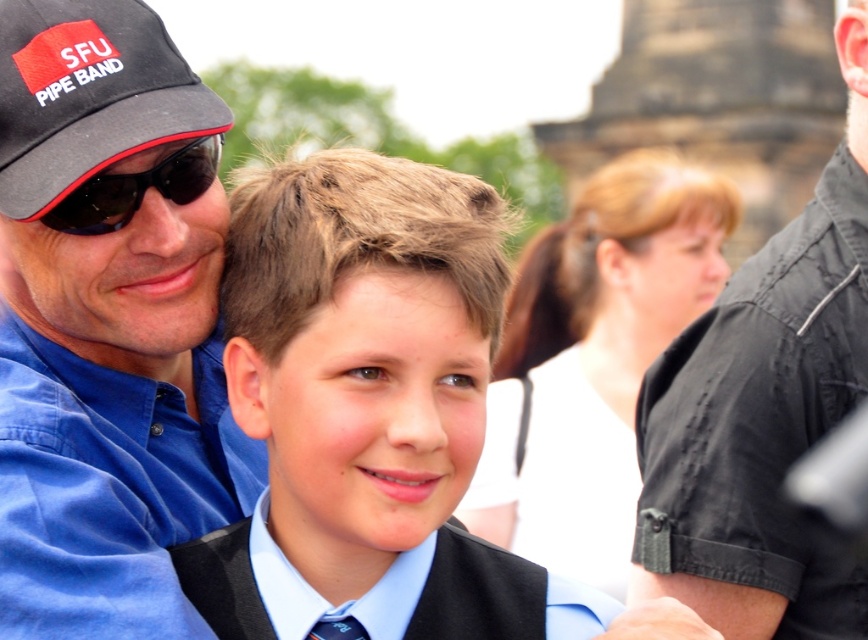
Is black fabric baseball cap at upper left positioned before black plastic sunglasses at left?

Yes.

I want to click on black fabric baseball cap at upper left, so click(x=89, y=96).

You are a GUI agent. You are given a task and a screenshot of the screen. Output one action in this format:
    pyautogui.click(x=<x>, y=<y>)
    Task: Click on the black fabric baseball cap at upper left
    This screenshot has width=868, height=640.
    Given the screenshot: What is the action you would take?
    pyautogui.click(x=89, y=96)

Based on the photo, is black matte shirt at upper right to the right of blue silk tie at lower center from the viewer's perspective?

Yes, black matte shirt at upper right is to the right of blue silk tie at lower center.

Is black matte shirt at upper right taller than blue silk tie at lower center?

Yes, black matte shirt at upper right is taller than blue silk tie at lower center.

Who is more forward, (849, 266) or (345, 620)?

Point (345, 620) is in front.

I want to click on black matte shirt at upper right, so click(x=763, y=412).

Does matte black vest at center have a smaller size compared to black fabric baseball cap at upper left?

No, matte black vest at center is not smaller than black fabric baseball cap at upper left.

Is point (385, 412) in front of point (0, 0)?

Yes, it is.

Locate an element on the screen. This screenshot has height=640, width=868. matte black vest at center is located at coordinates (365, 406).